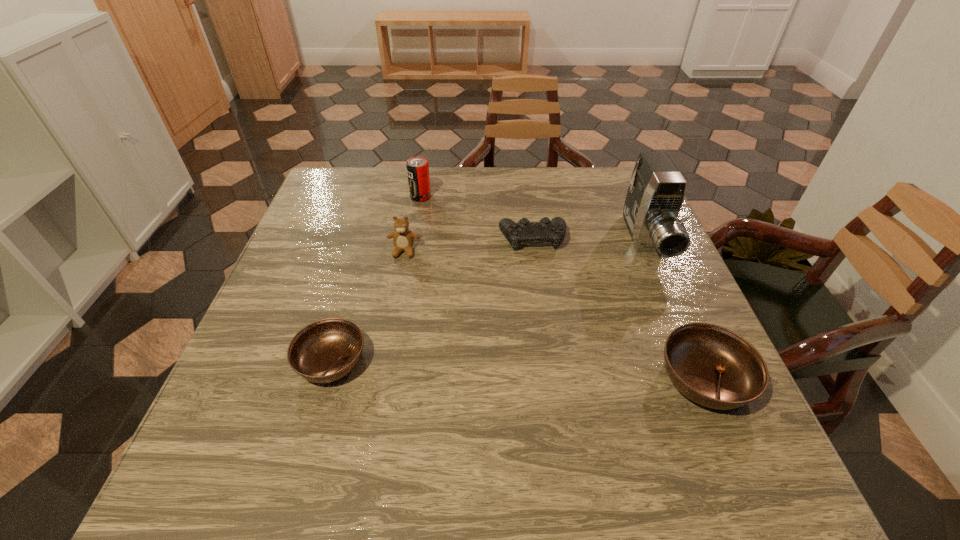
Locate an element on the screen. This screenshot has width=960, height=540. the shorter soup bowl is located at coordinates (324, 351).

Where is `the left soup bowl`? The image size is (960, 540). the left soup bowl is located at coordinates (324, 351).

The width and height of the screenshot is (960, 540). What are the coordinates of `the right soup bowl` in the screenshot? It's located at (715, 367).

Locate an element on the screen. The image size is (960, 540). the farthest object is located at coordinates (417, 167).

You are a GUI agent. You are given a task and a screenshot of the screen. Output one action in this format:
    pyautogui.click(x=<x>, y=<y>)
    Task: Click on the can
    
    Given the screenshot: What is the action you would take?
    [x=417, y=167]

At what (x,y) coordinates should I click in order to perform the action: click on camcorder. Please return your answer as a coordinate pair (x, y). Image resolution: width=960 pixels, height=540 pixels. Looking at the image, I should click on (656, 191).

Where is `the third object from right to left`? This screenshot has width=960, height=540. the third object from right to left is located at coordinates tap(546, 230).

Find the location of a particular element. This screenshot has width=960, height=540. the fourth shortest object is located at coordinates (403, 238).

This screenshot has height=540, width=960. In order to click on free space located on the back of the shorter soup bowl in this screenshot , I will do `click(366, 244)`.

The height and width of the screenshot is (540, 960). I want to click on free region located 0.220m on the back of the right soup bowl, so click(x=658, y=268).